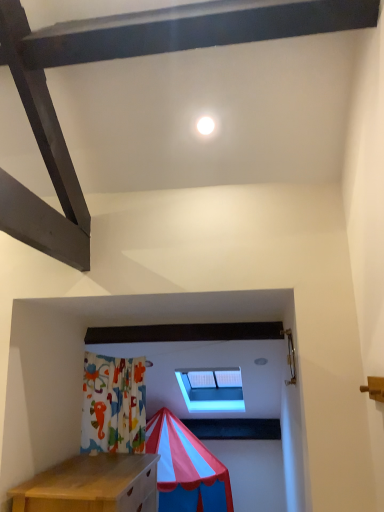
Where is `white glossy light at upper center`? The image size is (384, 512). white glossy light at upper center is located at coordinates (205, 125).

What do you see at coordinates (205, 125) in the screenshot? The width and height of the screenshot is (384, 512). I see `white glossy light at upper center` at bounding box center [205, 125].

Image resolution: width=384 pixels, height=512 pixels. What do you see at coordinates (212, 390) in the screenshot? I see `transparent plastic window at center` at bounding box center [212, 390].

This screenshot has height=512, width=384. What are the coordinates of `transparent plastic window at center` in the screenshot? It's located at (212, 390).

Where is `white glossy light at upper center`? This screenshot has height=512, width=384. white glossy light at upper center is located at coordinates (205, 125).

Can you confirm if transparent plastic window at center is positioned to the left of white glossy light at upper center?

No, transparent plastic window at center is not to the left of white glossy light at upper center.

Which is behind, transparent plastic window at center or white glossy light at upper center?

transparent plastic window at center is more distant.

Between point (229, 406) and point (210, 129), which one is positioned behind?

The point (229, 406) is farther.

From the image's perspective, does transparent plastic window at center appear lower than white glossy light at upper center?

Yes, from the image's perspective, transparent plastic window at center is beneath white glossy light at upper center.

From a real-world perspective, is transparent plastic window at center below white glossy light at upper center?

Yes, from a real-world perspective, transparent plastic window at center is below white glossy light at upper center.

Looking at this image, considering the sizes of objects transparent plastic window at center and white glossy light at upper center in the image provided, who is wider, transparent plastic window at center or white glossy light at upper center?

With larger width is transparent plastic window at center.

Is transparent plastic window at center taller or shorter than white glossy light at upper center?

transparent plastic window at center is taller than white glossy light at upper center.

Considering the sizes of objects transparent plastic window at center and white glossy light at upper center in the image provided, who is bigger, transparent plastic window at center or white glossy light at upper center?

With larger size is transparent plastic window at center.

Can we say transparent plastic window at center lies outside white glossy light at upper center?

Absolutely, transparent plastic window at center is external to white glossy light at upper center.

Is transparent plastic window at center next to white glossy light at upper center and touching it?

No, transparent plastic window at center is not in contact with white glossy light at upper center.

Is transparent plastic window at center looking in the opposite direction of white glossy light at upper center?

transparent plastic window at center is not turned away from white glossy light at upper center.

Consider the image. How much distance is there between transparent plastic window at center and white glossy light at upper center?

transparent plastic window at center is 9.37 feet away from white glossy light at upper center.

Locate an element on the screen. light above the transparent plastic window at center (from a real-world perspective) is located at coordinates (205, 125).

Which object is positioned more to the right, white glossy light at upper center or transparent plastic window at center?

From the viewer's perspective, transparent plastic window at center appears more on the right side.

Is white glossy light at upper center in front of or behind transparent plastic window at center in the image?

white glossy light at upper center is positioned closer to the viewer than transparent plastic window at center.

Which point is more forward, (204,125) or (190,371)?

The point (204,125) is closer.

From the image's perspective, would you say white glossy light at upper center is positioned over transparent plastic window at center?

Yes.

From a real-world perspective, relative to transparent plastic window at center, is white glossy light at upper center vertically above or below?

white glossy light at upper center is above transparent plastic window at center.

Considering the sizes of objects white glossy light at upper center and transparent plastic window at center in the image provided, who is thinner, white glossy light at upper center or transparent plastic window at center?

white glossy light at upper center is thinner.

From their relative heights in the image, would you say white glossy light at upper center is taller or shorter than transparent plastic window at center?

Clearly, white glossy light at upper center is shorter compared to transparent plastic window at center.

Is white glossy light at upper center bigger than transparent plastic window at center?

No.

Would you say white glossy light at upper center contains transparent plastic window at center?

Actually, transparent plastic window at center is outside white glossy light at upper center.

Is white glossy light at upper center next to transparent plastic window at center?

No, white glossy light at upper center is not with transparent plastic window at center.

Is white glossy light at upper center aimed at transparent plastic window at center?

No, white glossy light at upper center is not facing towards transparent plastic window at center.

Locate an element on the screen. The width and height of the screenshot is (384, 512). window on the right of white glossy light at upper center is located at coordinates (212, 390).

I want to click on light that appears above the transparent plastic window at center (from the image's perspective), so click(x=205, y=125).

Where is `light on the left of transparent plastic window at center`? The width and height of the screenshot is (384, 512). light on the left of transparent plastic window at center is located at coordinates (205, 125).